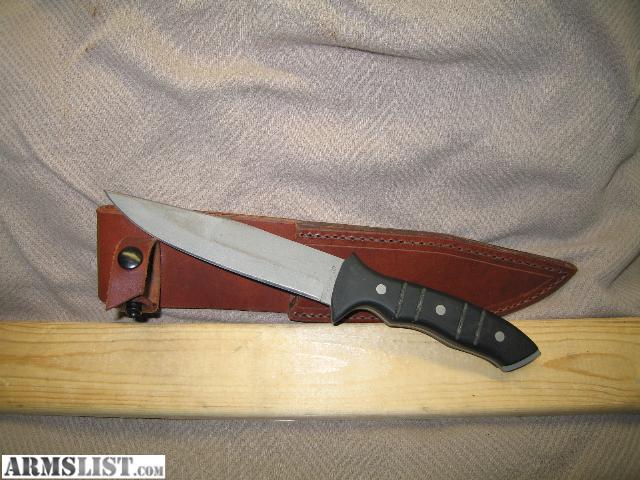
Locate an element on the screen. The width and height of the screenshot is (640, 480). gray blanket is located at coordinates (509, 191), (390, 446).